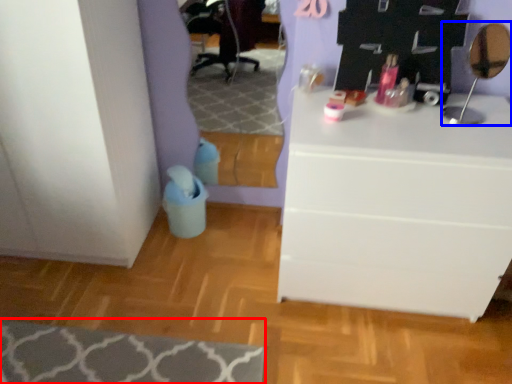
Question: Among these objects, which one is farthest to the camera, mat (highlighted by a red box) or mirror (highlighted by a blue box)?

Choices:
 (A) mat
 (B) mirror

Answer: (A)